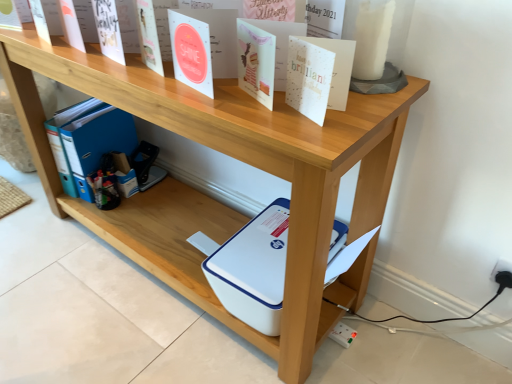
Question: From a real-world perspective, is white paper at upper center, the second paperback book viewed from the left, physically located above or below white matte paper at upper center, which ranks as the first paperback book in left-to-right order?

Choices:
 (A) above
 (B) below

Answer: (B)

Question: From their relative heights in the image, would you say white paper at upper center, the 1th paperback book positioned from the right, is taller or shorter than white matte paper at upper center, arranged as the second paperback book when ordered from the bottom?

Choices:
 (A) short
 (B) tall

Answer: (A)

Question: Which of these objects is positioned farthest from the white paper at upper center, the 1th paperback book positioned from the right?

Choices:
 (A) white matte paper at upper center, the 2th paperback book from the front
 (B) white plastic electric outlet at lower right

Answer: (B)

Question: Based on their relative distances, which object is farther from the white paper at upper center, the 1th paperback book positioned from the right?

Choices:
 (A) white matte paper at upper center, marked as the first paperback book in a top-to-bottom arrangement
 (B) white plastic electric outlet at lower right

Answer: (B)